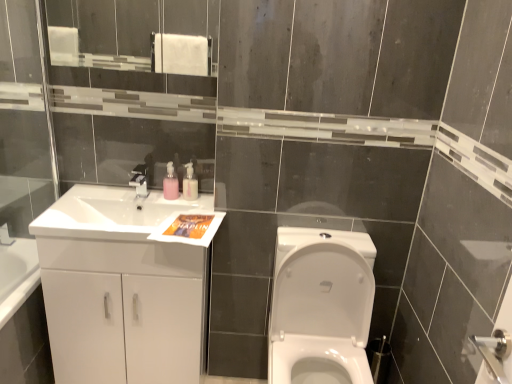
Question: Is white glossy cabinet at left with matte silver faucet at upper center?

Choices:
 (A) yes
 (B) no

Answer: (B)

Question: Considering the relative sizes of white glossy cabinet at left and matte silver faucet at upper center in the image provided, is white glossy cabinet at left thinner than matte silver faucet at upper center?

Choices:
 (A) no
 (B) yes

Answer: (A)

Question: Is white glossy cabinet at left behind matte silver faucet at upper center?

Choices:
 (A) no
 (B) yes

Answer: (A)

Question: Is white glossy cabinet at left shorter than matte silver faucet at upper center?

Choices:
 (A) yes
 (B) no

Answer: (B)

Question: Does white glossy cabinet at left appear on the right side of matte silver faucet at upper center?

Choices:
 (A) yes
 (B) no

Answer: (B)

Question: In terms of size, does white glossy sink at left appear bigger or smaller than white glossy toilet at center?

Choices:
 (A) small
 (B) big

Answer: (A)

Question: Choose the correct answer: Is white glossy sink at left inside white glossy toilet at center or outside it?

Choices:
 (A) inside
 (B) outside

Answer: (B)

Question: Is white glossy sink at left wider or thinner than white glossy toilet at center?

Choices:
 (A) wide
 (B) thin

Answer: (B)

Question: Is point (198, 208) closer or farther from the camera than point (359, 236)?

Choices:
 (A) farther
 (B) closer

Answer: (A)

Question: From a real-world perspective, is pink plastic soap dispenser at upper center, marked as the first soap dispenser in a right-to-left arrangement, positioned above or below matte silver faucet at upper center?

Choices:
 (A) below
 (B) above

Answer: (B)

Question: Is pink plastic soap dispenser at upper center, marked as the first soap dispenser in a right-to-left arrangement, taller or shorter than matte silver faucet at upper center?

Choices:
 (A) tall
 (B) short

Answer: (A)

Question: Is pink plastic soap dispenser at upper center, marked as the 2th soap dispenser in a left-to-right arrangement, wider or thinner than matte silver faucet at upper center?

Choices:
 (A) thin
 (B) wide

Answer: (A)

Question: From the image's perspective, is pink plastic soap dispenser at upper center, marked as the 2th soap dispenser in a left-to-right arrangement, located above or below matte silver faucet at upper center?

Choices:
 (A) above
 (B) below

Answer: (A)

Question: Is pink matte soap dispenser at upper center, arranged as the 1th soap dispenser when viewed from the left, taller or shorter than white glossy sink at left?

Choices:
 (A) tall
 (B) short

Answer: (B)

Question: Which is correct: pink matte soap dispenser at upper center, positioned as the 2th soap dispenser in right-to-left order, is inside white glossy sink at left, or outside of it?

Choices:
 (A) outside
 (B) inside

Answer: (A)